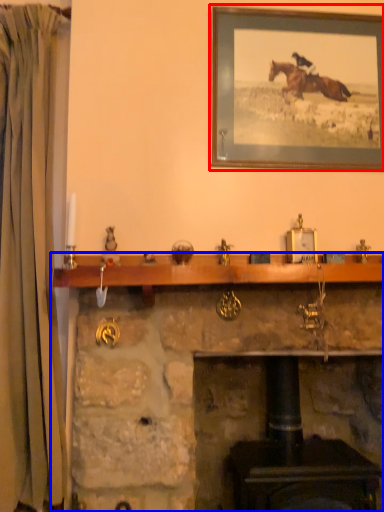
Question: Which point is closer to the camera, picture frame (highlighted by a red box) or fireplace (highlighted by a blue box)?

Choices:
 (A) picture frame
 (B) fireplace

Answer: (B)